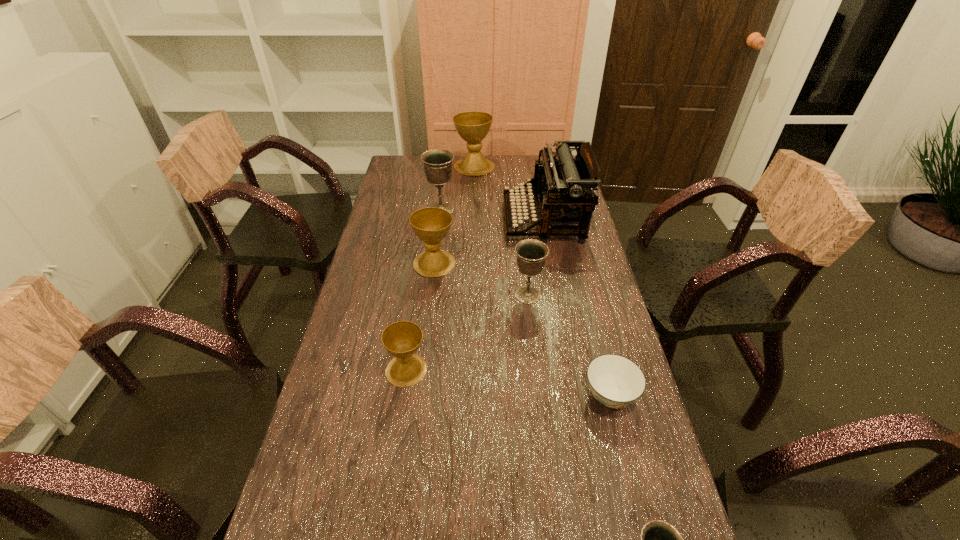
The width and height of the screenshot is (960, 540). Identify the location of vacant region located 0.120m on the left of the smallest brown chalice. (340, 370).

Where is `free region located on the left of the shortest object`? The height and width of the screenshot is (540, 960). free region located on the left of the shortest object is located at coordinates (446, 395).

The image size is (960, 540). Find the location of `object located at the far edge`. object located at the far edge is located at coordinates (473, 127).

Identify the location of object present at the left edge. (401, 339).

Find the location of a particular element. This screenshot has height=540, width=960. typewriter that is at the right edge is located at coordinates (566, 185).

I want to click on soup bowl situated at the right edge, so click(615, 381).

Identify the location of vacant space at the far edge of the desktop. This screenshot has height=540, width=960. (454, 173).

At what (x,y) coordinates should I click in order to perform the action: click on free location at the left edge. Please return your answer as a coordinate pair (x, y). The width and height of the screenshot is (960, 540). Looking at the image, I should click on (375, 231).

Where is `free space at the right edge of the desktop`? Image resolution: width=960 pixels, height=540 pixels. free space at the right edge of the desktop is located at coordinates (589, 260).

In the image, there is a desktop. Identify the location of vacant space at the far left corner. This screenshot has height=540, width=960. (394, 179).